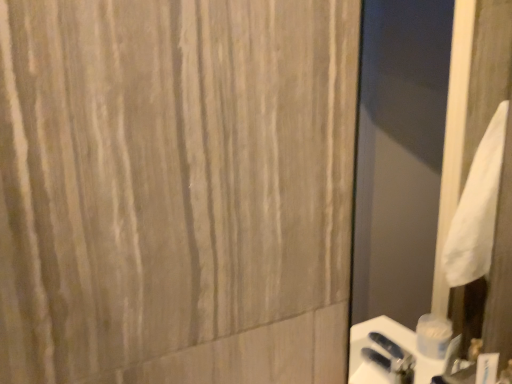
What is the approximate height of white fabric screen door at right?

white fabric screen door at right is 30.55 inches tall.

The image size is (512, 384). What are the coordinates of `white fabric screen door at right` in the screenshot? It's located at (487, 70).

Describe the element at coordinates (487, 70) in the screenshot. I see `white fabric screen door at right` at that location.

Where is `white fabric screen door at right`? The height and width of the screenshot is (384, 512). white fabric screen door at right is located at coordinates (487, 70).